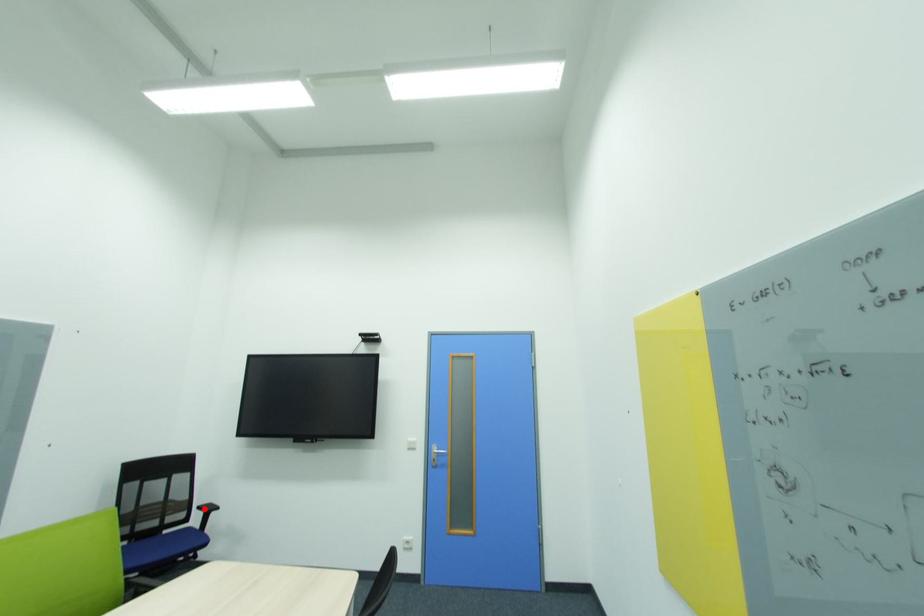
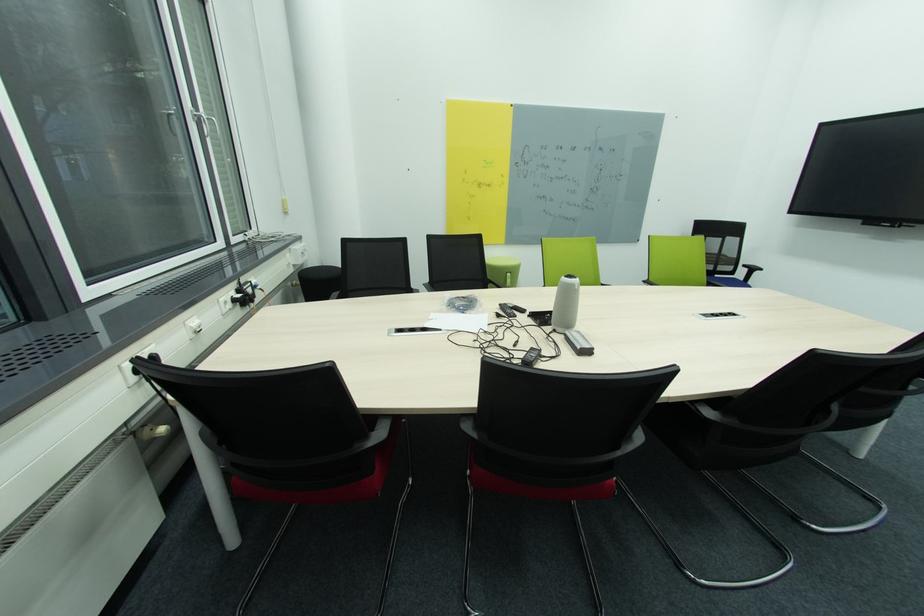
Where in the second image is the point corresponding to the highlighted location from the first image?

(749, 267)